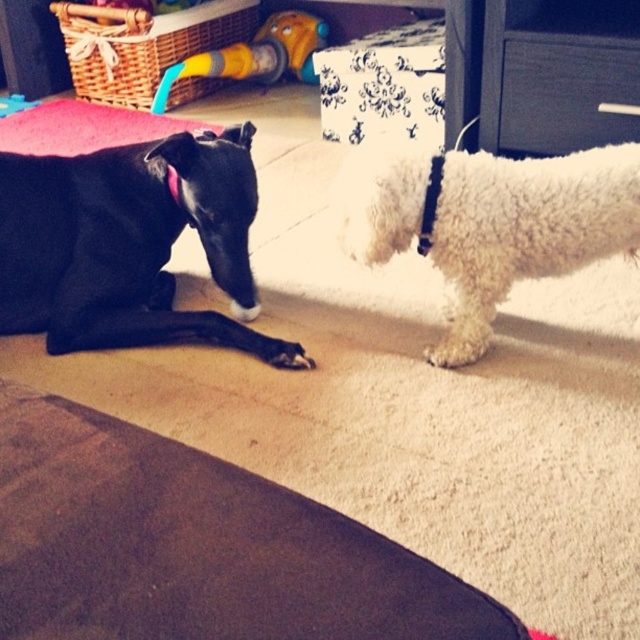
Question: Does black plastic drawer at upper right come in front of rubber hose at upper center?

Choices:
 (A) no
 (B) yes

Answer: (B)

Question: Estimate the real-world distances between objects in this image. Which object is closer to the black fabric neckband at left?

Choices:
 (A) black smooth dog at left
 (B) rubber hose at upper center

Answer: (A)

Question: Which of the following is the closest to the observer?

Choices:
 (A) (172, 177)
 (B) (513, 86)

Answer: (A)

Question: Is white fluffy dog at right thinner than black plastic drawer at upper right?

Choices:
 (A) no
 (B) yes

Answer: (A)

Question: Is white fluffy dog at right thinner than rubber hose at upper center?

Choices:
 (A) no
 (B) yes

Answer: (B)

Question: Estimate the real-world distances between objects in this image. Which object is closer to the black fabric neckband at left?

Choices:
 (A) white fluffy dog at right
 (B) rubber hose at upper center

Answer: (A)